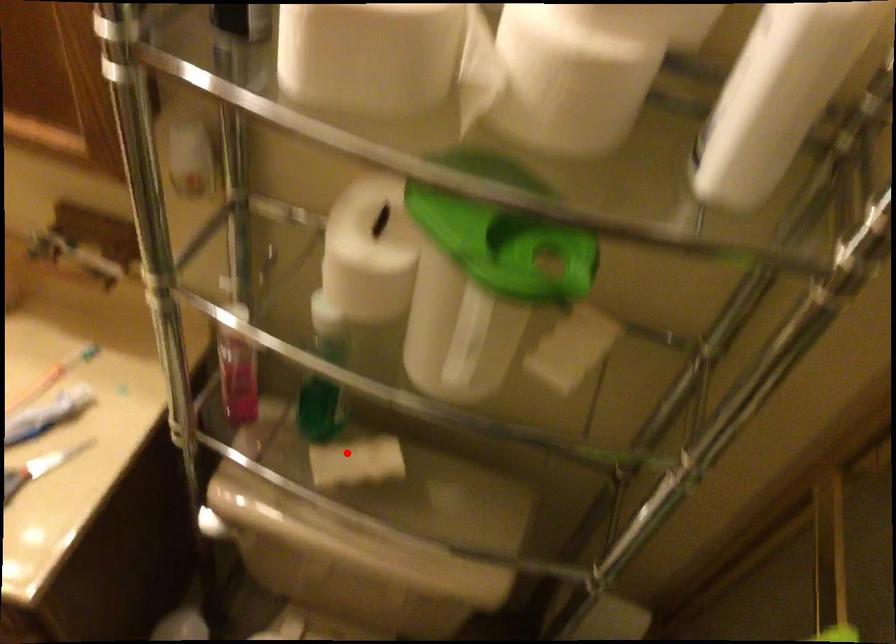
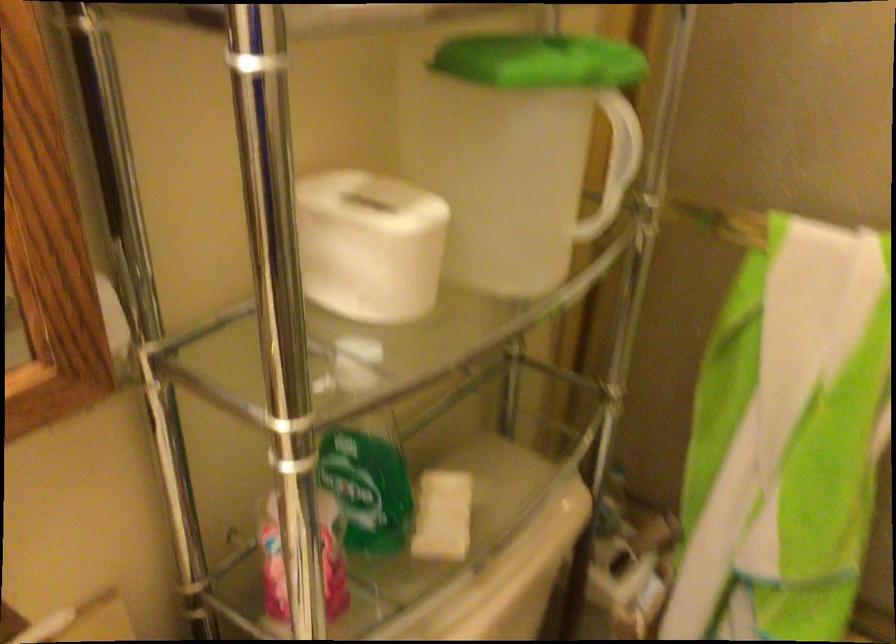
Where in the second image is the point corresponding to the highlighted location from the first image?

(442, 516)